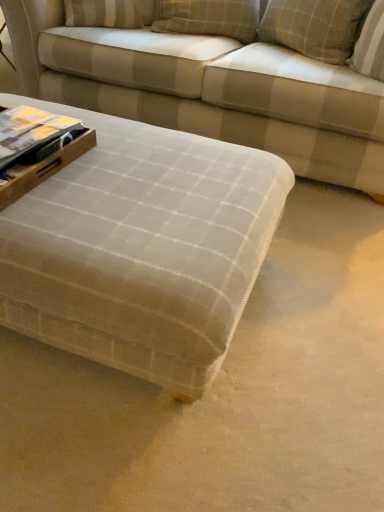
Locate an element on the screen. free location to the right of matte paper book at left is located at coordinates (113, 167).